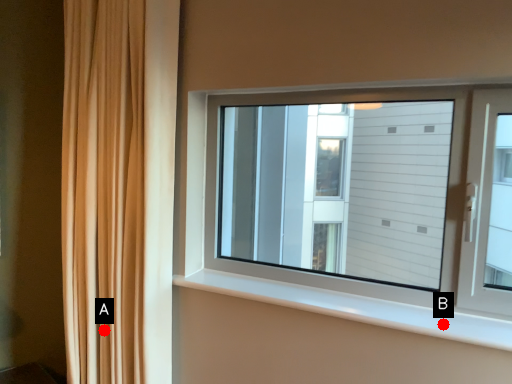
Question: Two points are circled on the image, labeled by A and B beside each circle. Which point is closer to the camera?

Choices:
 (A) A is closer
 (B) B is closer

Answer: (B)